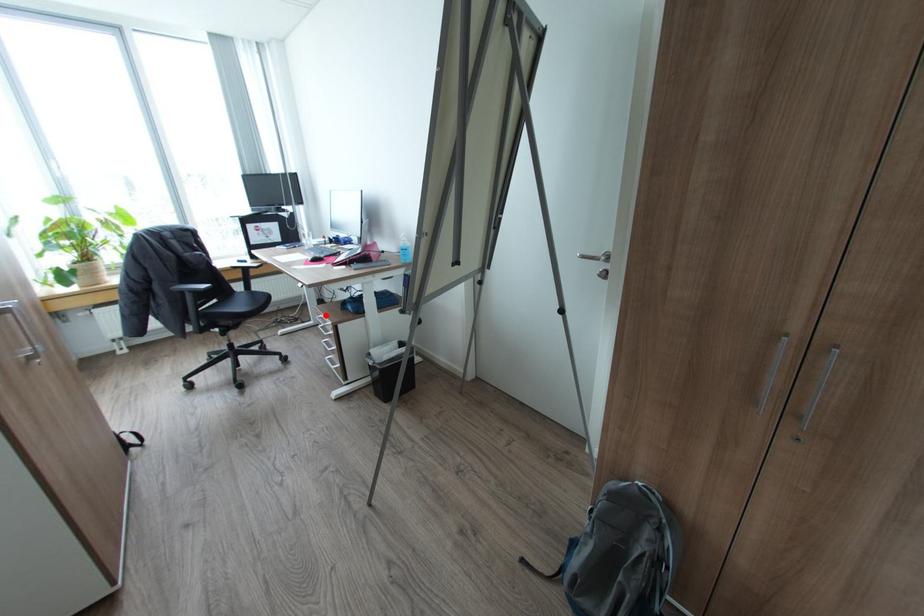
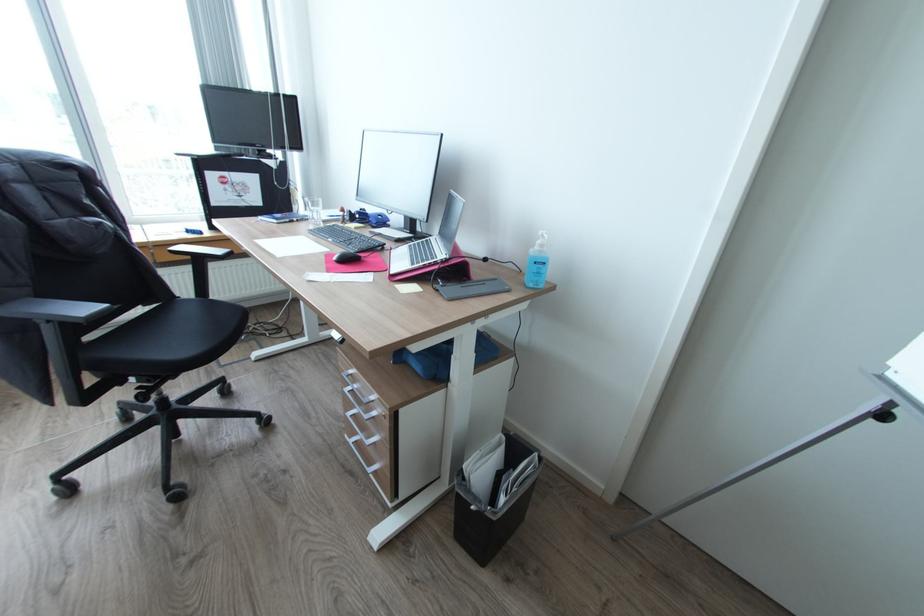
In the second image, find the point that corresponds to the highlighted location in the first image.

(357, 371)